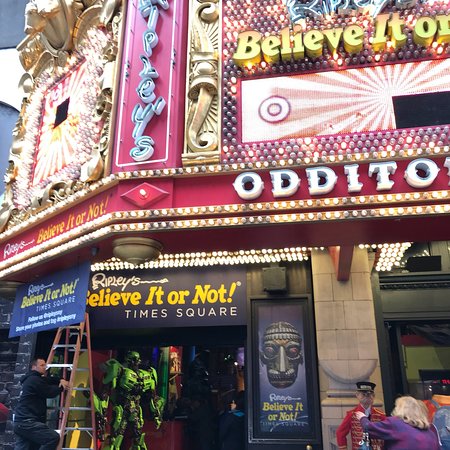
The width and height of the screenshot is (450, 450). Identify the location of entrances. (431, 347), (172, 448).